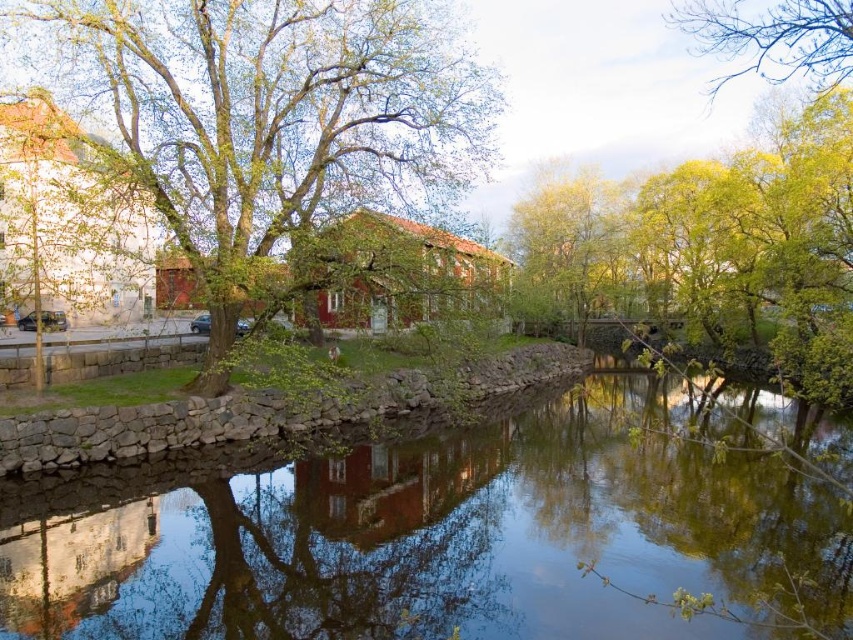
Is clear water at center bigger than yellow-green leaves at upper center?

No.

Who is higher up, clear water at center or yellow-green leaves at upper center?

yellow-green leaves at upper center is above.

Identify the location of clear water at center. (440, 536).

In the scene shown: Which of these two, yellow-green leaves at upper center or green leafy tree at upper right, stands shorter?

Standing shorter between the two is yellow-green leaves at upper center.

Image resolution: width=853 pixels, height=640 pixels. Identify the location of yellow-green leaves at upper center. (572, 246).

The height and width of the screenshot is (640, 853). Describe the element at coordinates (572, 246) in the screenshot. I see `yellow-green leaves at upper center` at that location.

Find the location of a particular element. yellow-green leaves at upper center is located at coordinates (572, 246).

Is clear water at center to the left of green leafy tree at upper left from the viewer's perspective?

No, clear water at center is not to the left of green leafy tree at upper left.

Consider the image. Does clear water at center lie behind green leafy tree at upper left?

That is False.

Describe the element at coordinates (440, 536) in the screenshot. I see `clear water at center` at that location.

Locate an element on the screen. clear water at center is located at coordinates (440, 536).